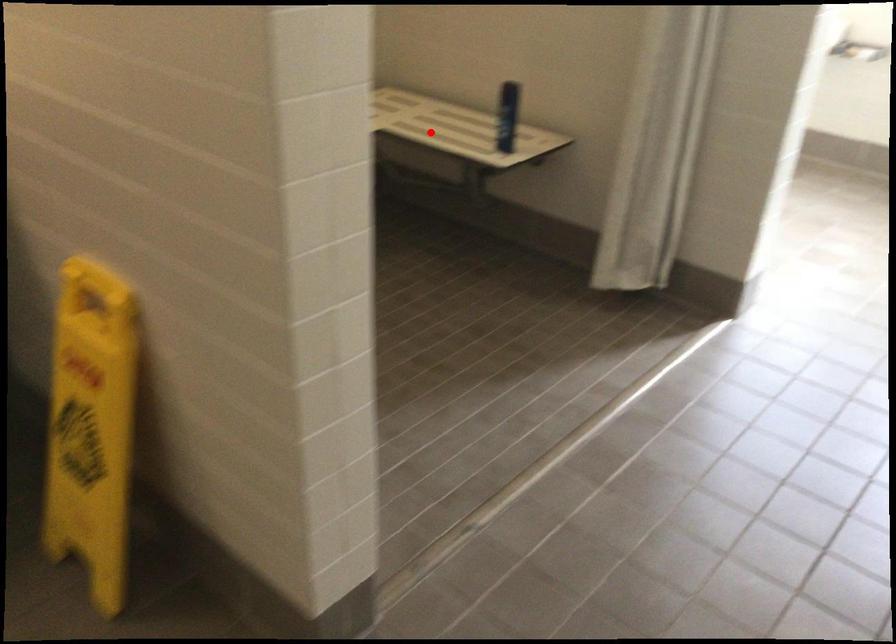
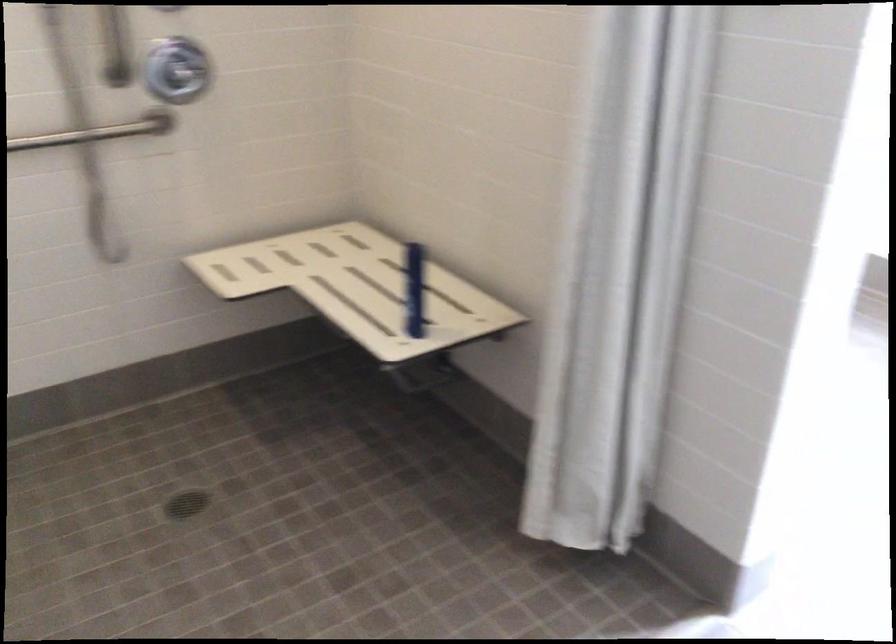
Question: I am providing you with two images of the same scene from different viewpoints. Given a red point in image1, look at the same physical point in image2. Is it:

Choices:
 (A) Closer to the viewpoint
 (B) Farther from the viewpoint

Answer: (A)